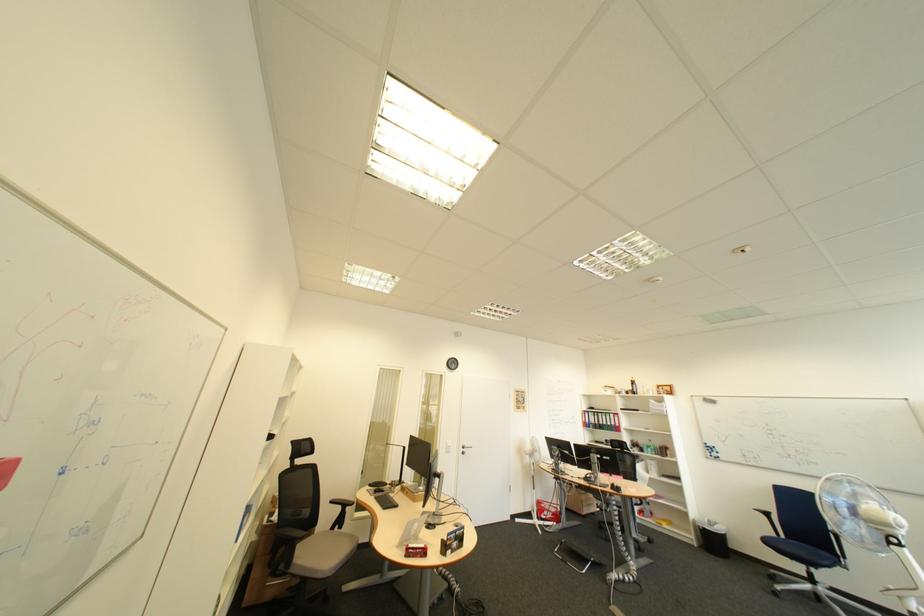
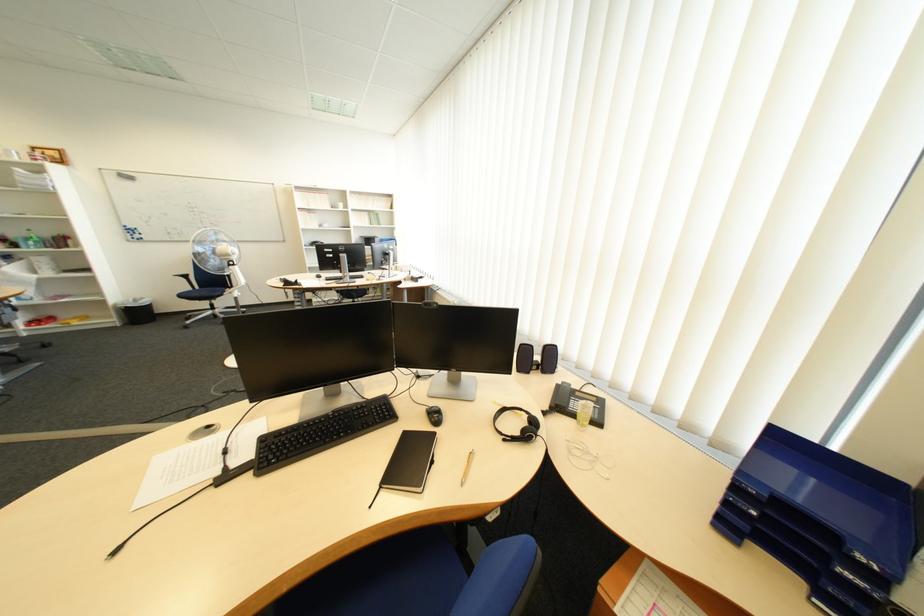
Locate, in the second image, the point that corresponds to (x=661, y=448) in the first image.

(41, 240)